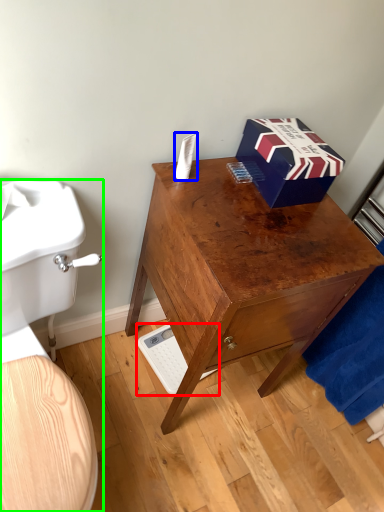
Question: Which object is positioned closest to scale (highlighted by a red box)? Select from toilet paper (highlighted by a blue box) and toilet (highlighted by a green box).

Choices:
 (A) toilet paper
 (B) toilet

Answer: (B)